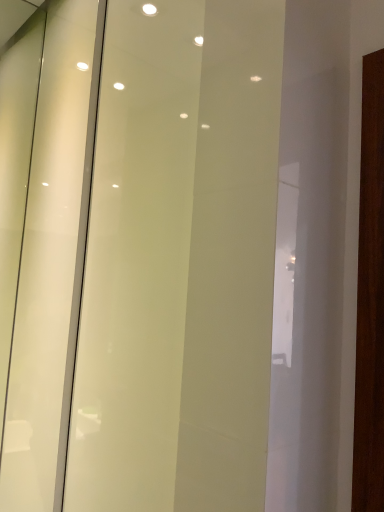
Locate an element on the screen. The width and height of the screenshot is (384, 512). transparent glass screen door at center is located at coordinates 137,261.

Describe the element at coordinates (137, 261) in the screenshot. The image size is (384, 512). I see `transparent glass screen door at center` at that location.

Measure the distance between point (123, 14) and camera.

Point (123, 14) is 35.71 inches from camera.

In order to face transparent glass screen door at center, should I rotate leftwards or rightwards?

You should rotate left by 10.416 degrees.

The height and width of the screenshot is (512, 384). What are the coordinates of `transparent glass screen door at center` in the screenshot? It's located at pyautogui.click(x=137, y=261).